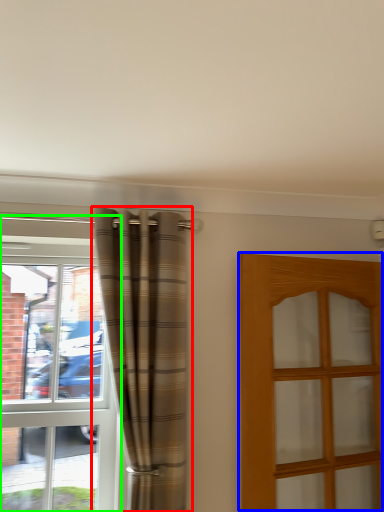
Question: Which is farther away from curtain (highlighted by a red box)? door (highlighted by a blue box) or window (highlighted by a green box)?

Choices:
 (A) door
 (B) window

Answer: (A)